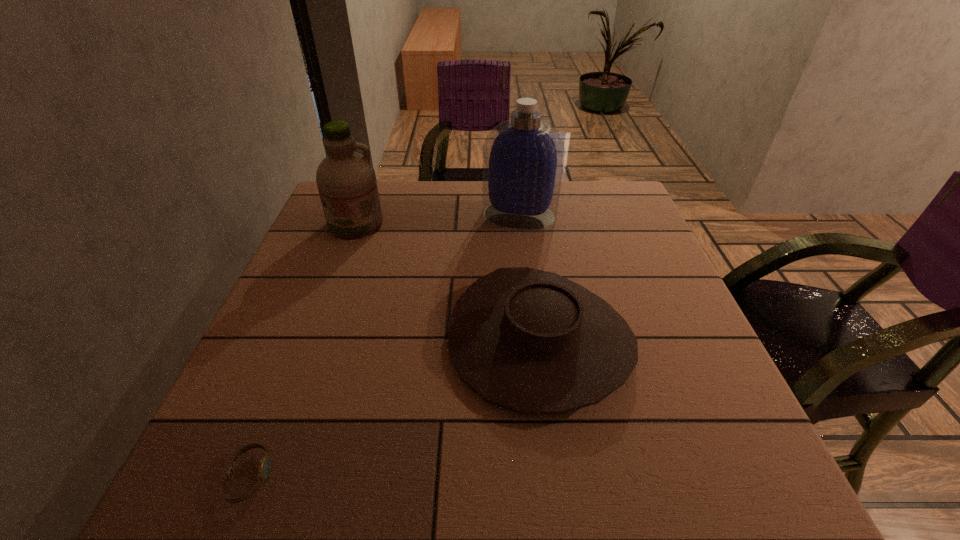
At what (x,y) coordinates should I click in order to perform the action: click on object that is at the near edge. Please return your answer as a coordinate pair (x, y). The image size is (960, 540). Looking at the image, I should click on (264, 467).

Where is `cleansing agent that is positioned at the left edge`? This screenshot has height=540, width=960. cleansing agent that is positioned at the left edge is located at coordinates (346, 180).

Find the location of a particular element. watch present at the left edge is located at coordinates (264, 467).

Where is `object that is at the right edge`? object that is at the right edge is located at coordinates point(531,341).

At what (x,y) coordinates should I click in order to perform the action: click on object present at the far left corner. Please return your answer as a coordinate pair (x, y). Looking at the image, I should click on (346, 180).

Find the location of a particular element. Image resolution: width=960 pixels, height=540 pixels. object that is at the near left corner is located at coordinates (264, 467).

In the image, there is a desktop. Identify the location of free space at the far edge. (572, 191).

Identify the location of vacant space at the near edge. (507, 497).

In the image, there is a desktop. What are the coordinates of `vacant space at the left edge` in the screenshot? It's located at (339, 240).

Identify the location of free spot at the right edge of the desktop. The height and width of the screenshot is (540, 960). (667, 434).